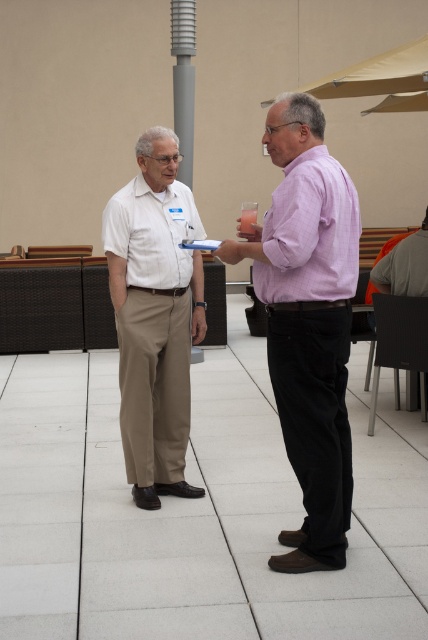
Which is more to the left, purple cotton shirt at right or light beige cotton pants at left?

light beige cotton pants at left

Between point (344, 563) and point (166, 465), which one is positioned behind?

The point (166, 465) is behind.

What do you see at coordinates (308, 323) in the screenshot? I see `purple cotton shirt at right` at bounding box center [308, 323].

Locate an element on the screen. The image size is (428, 640). purple cotton shirt at right is located at coordinates (308, 323).

Does purple cotton shirt at right appear over purple cotton shirt at center?

Actually, purple cotton shirt at right is below purple cotton shirt at center.

Does purple cotton shirt at right come in front of purple cotton shirt at center?

No, it is behind purple cotton shirt at center.

Is point (329, 355) more distant than point (302, 227)?

Yes.

I want to click on purple cotton shirt at right, so click(308, 323).

Is purple cotton shirt at right smaller than white matte shirt at center?

No.

The width and height of the screenshot is (428, 640). I want to click on purple cotton shirt at right, so click(x=308, y=323).

Between point (336, 385) and point (148, 224), which one is positioned in front?

Point (336, 385) is in front.

Identify the location of purple cotton shirt at right. The image size is (428, 640). (308, 323).